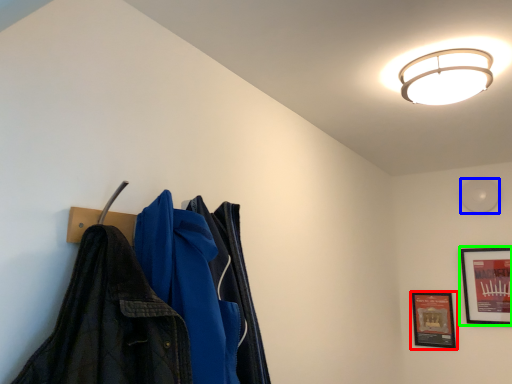
Question: Which object is the closest to the picture frame (highlighted by a red box)? Choose among these: light (highlighted by a blue box) or picture frame (highlighted by a green box).

Choices:
 (A) light
 (B) picture frame

Answer: (B)